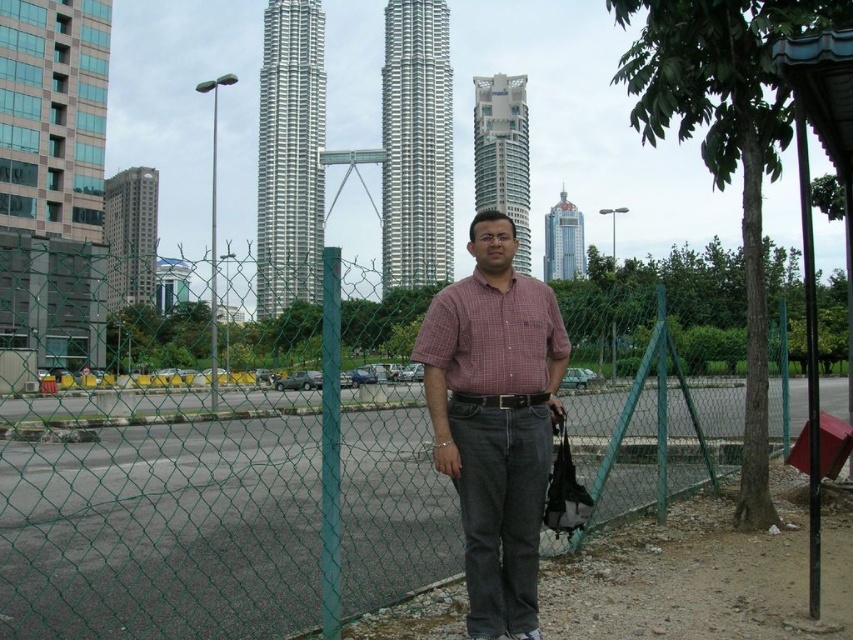
You are a fashion designer analyzing the urban scene. You notice two shirts on the man in the image. Which shirt is thinner, the plaid cotton shirt at center or the checkered fabric shirt at center?

The plaid cotton shirt at center is thinner than the checkered fabric shirt at center.

You are a photographer trying to capture the man in the plaid cotton shirt at center and the checkered fabric shirt at center. Since both shirts are at the center, which one will appear larger in your photo?

The plaid cotton shirt at center appears larger because it is closer to the viewer than the checkered fabric shirt at center.